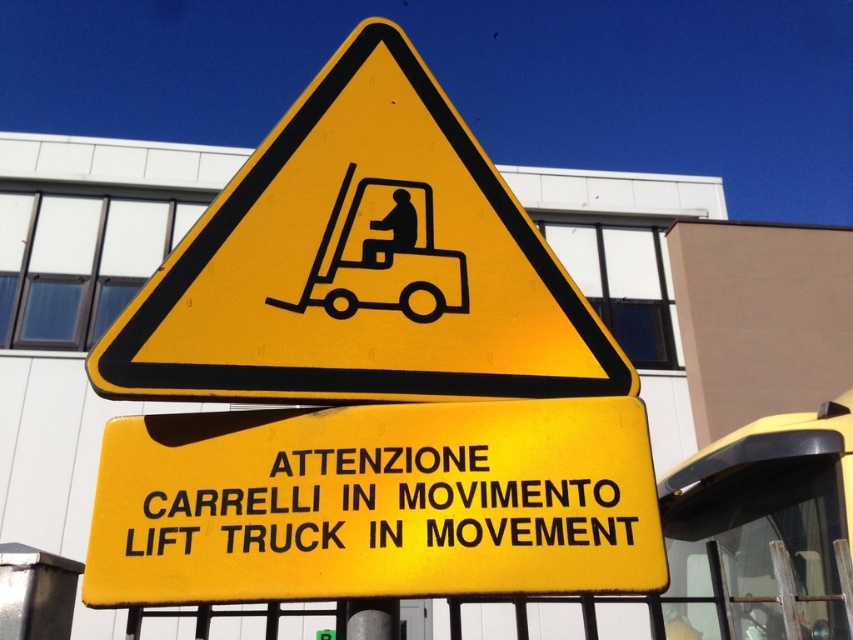
Can you confirm if yellow matte triangle at upper center is smaller than yellow matte sign at center?

No.

How much distance is there between yellow matte triangle at upper center and yellow matte sign at center?

A distance of 6.73 inches exists between yellow matte triangle at upper center and yellow matte sign at center.

Find the location of a particular element. The width and height of the screenshot is (853, 640). yellow matte triangle at upper center is located at coordinates (363, 266).

Consider the image. Can you confirm if yellow matte triangle at upper center is positioned to the left of black matte forklift at center?

Indeed, yellow matte triangle at upper center is positioned on the left side of black matte forklift at center.

Between point (151, 380) and point (387, 248), which one is positioned in front?

Positioned in front is point (151, 380).

This screenshot has width=853, height=640. I want to click on yellow matte triangle at upper center, so click(x=363, y=266).

Based on the photo, between yellow matte sign at center and black matte forklift at center, which one is positioned lower?

yellow matte sign at center is below.

Which is more to the left, yellow matte sign at center or black matte forklift at center?

From the viewer's perspective, black matte forklift at center appears more on the left side.

Does point (534, 545) lie behind point (431, 280)?

No.

The width and height of the screenshot is (853, 640). In order to click on yellow matte sign at center in this screenshot , I will do `click(375, 502)`.